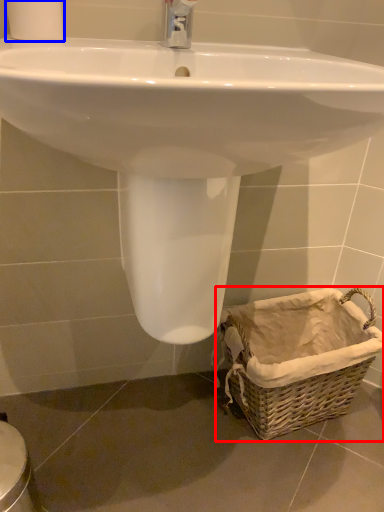
Question: Among these objects, which one is farthest to the camera, basket (highlighted by a red box) or toilet paper (highlighted by a blue box)?

Choices:
 (A) basket
 (B) toilet paper

Answer: (A)